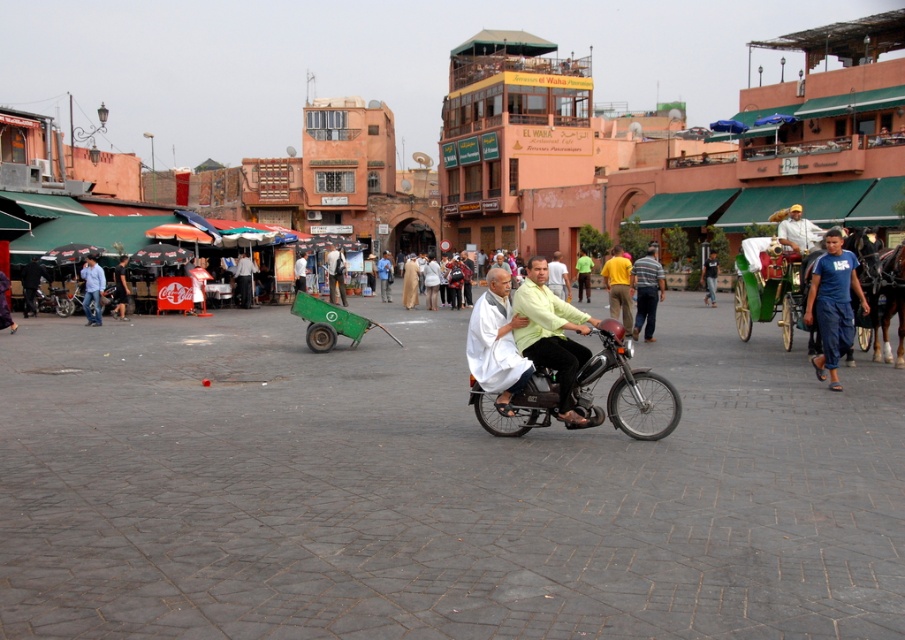
Question: Can you confirm if blue fabric pants at lower right is positioned to the left of light green shirt at center?

Choices:
 (A) yes
 (B) no

Answer: (B)

Question: Is light brown shirt at center in front of light blue jeans at center?

Choices:
 (A) no
 (B) yes

Answer: (B)

Question: Which object is closer to the camera taking this photo?

Choices:
 (A) green fabric shirt at center
 (B) light green fabric shirt at center
 (C) green matte cart at center

Answer: (B)

Question: Estimate the real-world distances between objects in this image. Which object is farther from the green matte cart at center?

Choices:
 (A) light blue jeans at center
 (B) white cloth at center
 (C) dark blue jeans at center
 (D) shiny chrome motorcycle at center

Answer: (A)

Question: Is the position of light blue jeans at center less distant than that of light brown leather jacket at center?

Choices:
 (A) yes
 (B) no

Answer: (A)

Question: Which point is farther to the camera?

Choices:
 (A) (669, 401)
 (B) (570, 380)

Answer: (A)